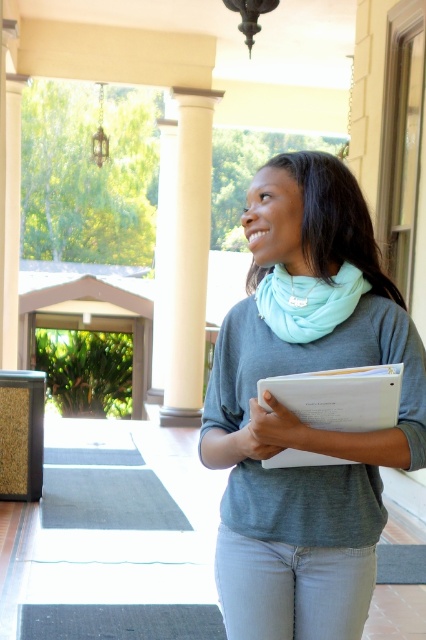
Question: From the image, what is the correct spatial relationship of white smooth column at center in relation to tiffany blue soft scarf at center?

Choices:
 (A) left
 (B) right

Answer: (A)

Question: Is light blue denim jeans at lower center bigger than white smooth column at center?

Choices:
 (A) no
 (B) yes

Answer: (A)

Question: Based on their relative distances, which object is nearer to the gray matte scarf at center?

Choices:
 (A) light blue denim jeans at lower center
 (B) white paper clipboard at center

Answer: (B)

Question: Which point is farther to the camera?

Choices:
 (A) white smooth column at center
 (B) gray matte scarf at center

Answer: (A)

Question: Which point appears farthest from the camera in this image?

Choices:
 (A) (412, 380)
 (B) (172, 420)

Answer: (B)

Question: Is light blue denim jeans at lower center below tiffany blue soft scarf at center?

Choices:
 (A) no
 (B) yes

Answer: (B)